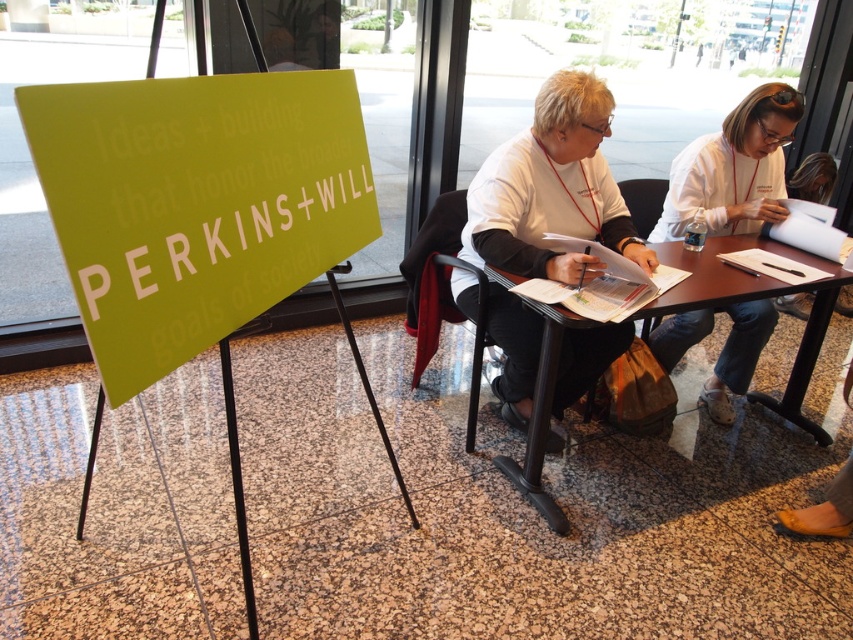
Consider the image. Is white matte shirt at center thinner than black plastic chair at center?

Incorrect, white matte shirt at center's width is not less than black plastic chair at center's.

This screenshot has width=853, height=640. Describe the element at coordinates (552, 189) in the screenshot. I see `white matte shirt at center` at that location.

Identify the location of white matte shirt at center. This screenshot has width=853, height=640. pyautogui.click(x=552, y=189).

From the picture: Can you confirm if green matte sign at left is bigger than white fabric shirt at upper right?

Yes.

Does green matte sign at left have a greater width compared to white fabric shirt at upper right?

No.

Is point (161, 320) more distant than point (766, 298)?

No, it is in front of (766, 298).

This screenshot has height=640, width=853. In order to click on green matte sign at left in this screenshot , I will do `click(195, 204)`.

Is brown wooden table at center taller than black plastic chair at center?

Yes, brown wooden table at center is taller than black plastic chair at center.

Where is `brown wooden table at center`? The height and width of the screenshot is (640, 853). brown wooden table at center is located at coordinates (755, 298).